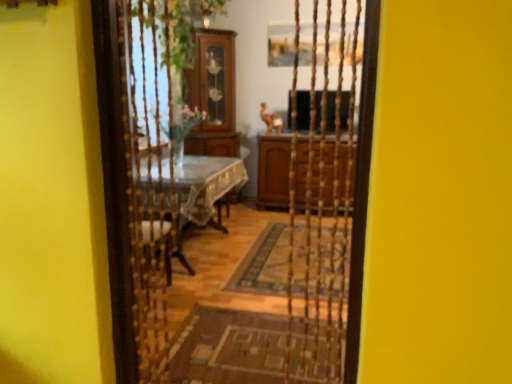
Question: From the image's perspective, relative to brown woven mat at center, is brown wood cabinet at center above or below?

Choices:
 (A) above
 (B) below

Answer: (A)

Question: Is brown wood cabinet at center spatially inside brown woven mat at center, or outside of it?

Choices:
 (A) outside
 (B) inside

Answer: (A)

Question: Is point (340, 183) closer or farther from the camera than point (173, 367)?

Choices:
 (A) closer
 (B) farther

Answer: (B)

Question: In terms of size, does brown woven mat at center appear bigger or smaller than brown wood cabinet at center?

Choices:
 (A) big
 (B) small

Answer: (B)

Question: Does point (262, 332) appear closer or farther from the camera than point (261, 185)?

Choices:
 (A) closer
 (B) farther

Answer: (A)

Question: Considering their positions, is brown woven mat at center located in front of or behind brown wood cabinet at center?

Choices:
 (A) front
 (B) behind

Answer: (A)

Question: Considering the positions of brown woven mat at center and brown wood cabinet at center in the image, is brown woven mat at center taller or shorter than brown wood cabinet at center?

Choices:
 (A) short
 (B) tall

Answer: (A)